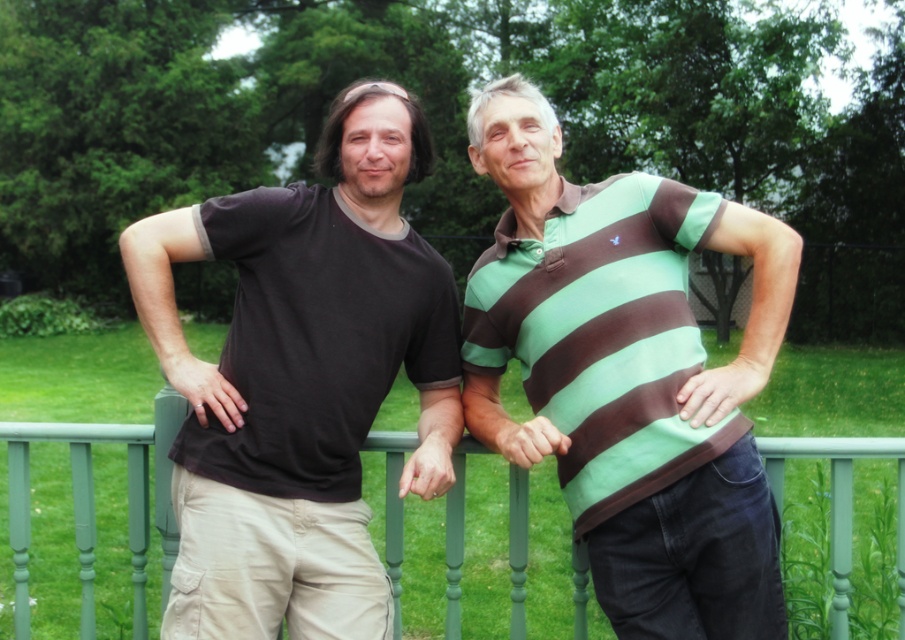
Question: Among these points, which one is farthest from the camera?

Choices:
 (A) (305, 394)
 (B) (391, 332)
 (C) (653, 332)

Answer: (B)

Question: Does matte black t-shirt at left appear on the right side of green painted wood at center?

Choices:
 (A) no
 (B) yes

Answer: (A)

Question: Which of the following is the closest to the observer?

Choices:
 (A) (719, 490)
 (B) (521, 492)
 (C) (399, 260)

Answer: (A)

Question: Which is farther from the green painted wood at center?

Choices:
 (A) matte black t-shirt at left
 (B) green striped polo shirt at center
 (C) matte brown striped polo shirt at center
 (D) matte black t-shirt at center

Answer: (B)

Question: Is matte black t-shirt at center closer to camera compared to green striped polo shirt at center?

Choices:
 (A) no
 (B) yes

Answer: (B)

Question: From the image, what is the correct spatial relationship of green striped polo shirt at center in relation to green painted wood at center?

Choices:
 (A) below
 (B) above

Answer: (B)